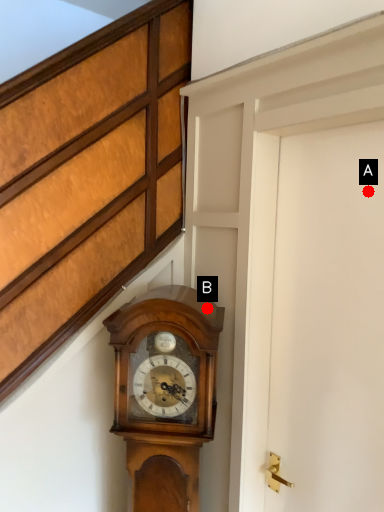
Question: Two points are circled on the image, labeled by A and B beside each circle. Which point is farther from the camera taking this photo?

Choices:
 (A) A is further
 (B) B is further

Answer: (B)